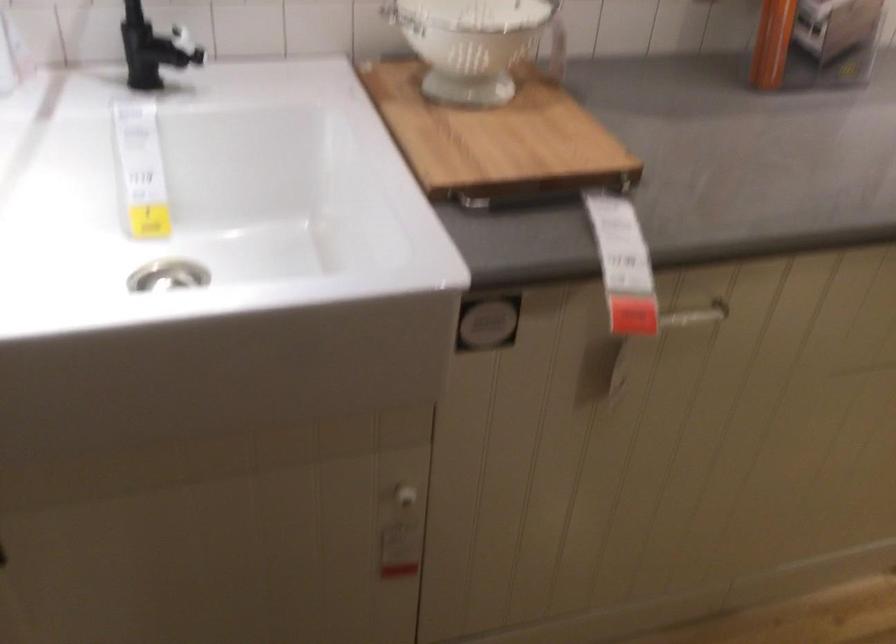
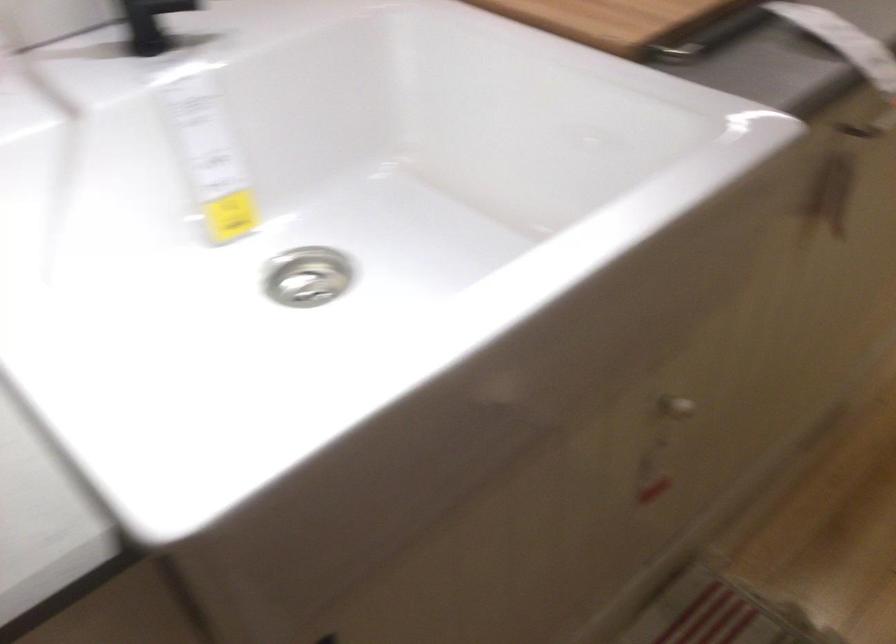
In a continuous first-person perspective shot, in which direction is the camera moving?

The cameraman walked toward left, forward.